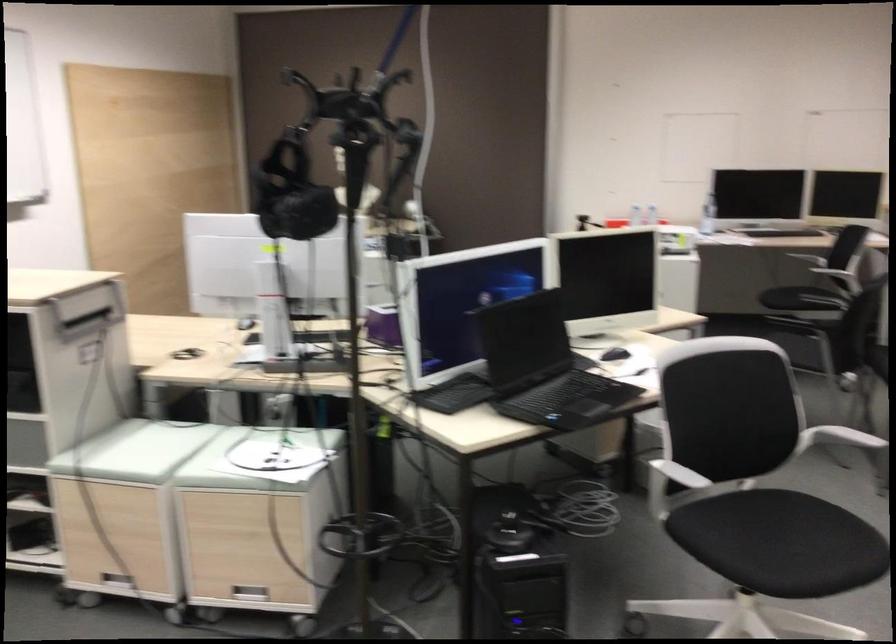
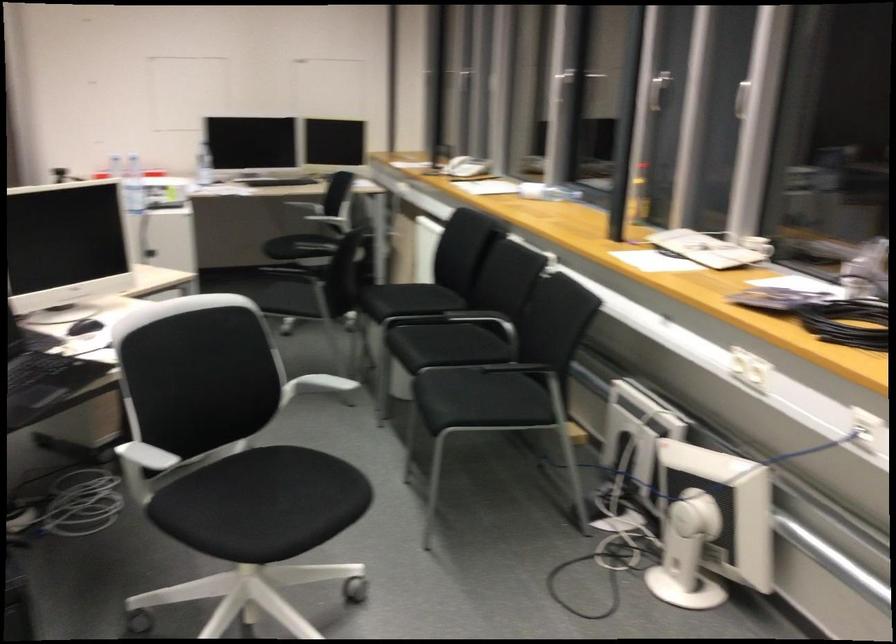
Question: The camera is either moving clockwise (left) or counter-clockwise (right) around the object. The first image is from the beginning of the video and the second image is from the end. Is the camera moving left or right when shooting the video?

Choices:
 (A) Left
 (B) Right

Answer: (A)